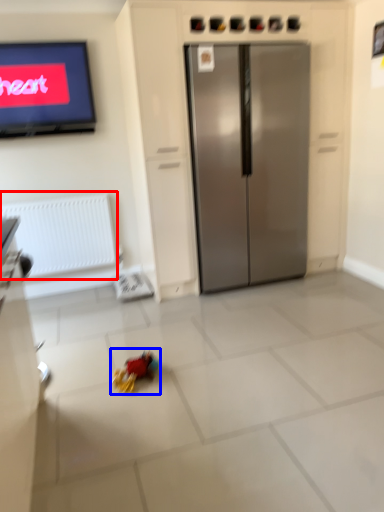
Question: Which object appears closest to the camera in this image, radiator (highlighted by a red box) or miniature (highlighted by a blue box)?

Choices:
 (A) radiator
 (B) miniature

Answer: (B)